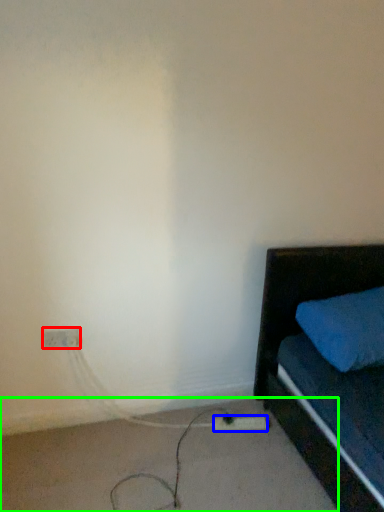
Question: Estimate the real-world distances between objects in this image. Which object is closer to electric outlet (highlighted by a red box), extension cord (highlighted by a blue box) or concrete (highlighted by a green box)?

Choices:
 (A) extension cord
 (B) concrete

Answer: (B)